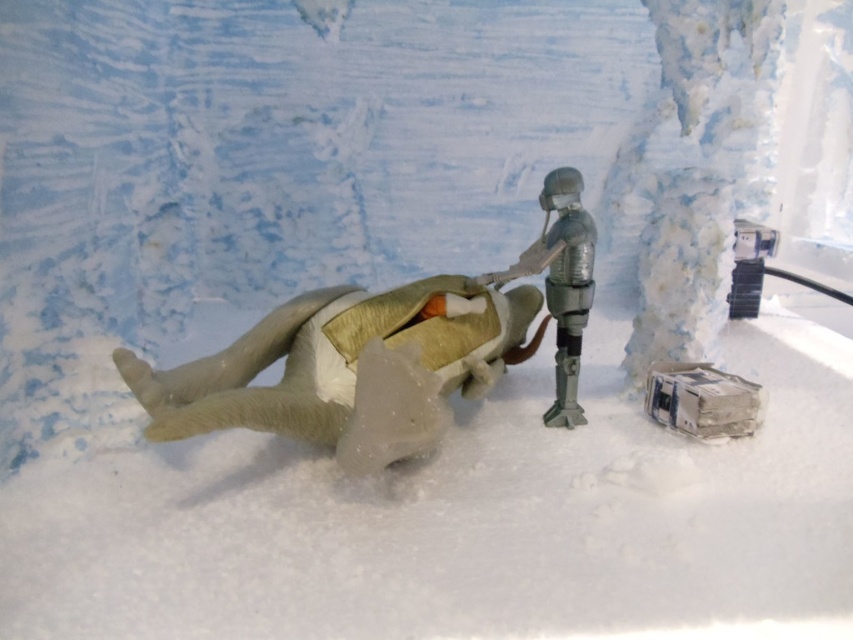
You are a hiker lost in a snowy cave. You see a fuzzy gray animal at center and a metallic silver figure at center. Which object is wider?

The fuzzy gray animal at center is wider than the metallic silver figure at center.

You are a rescue worker in the snowy cave. You see a fuzzy gray animal at center and a metallic silver figure at center. Which one is closer to the ground?

The fuzzy gray animal at center is located below metallic silver figure at center, so the fuzzy gray animal at center is closer to the ground.

In the snowy environment, there is a fuzzy gray animal at center and a metallic silver figure at center. Which one is positioned to the left?

The fuzzy gray animal at center is positioned to the left of the metallic silver figure at center.